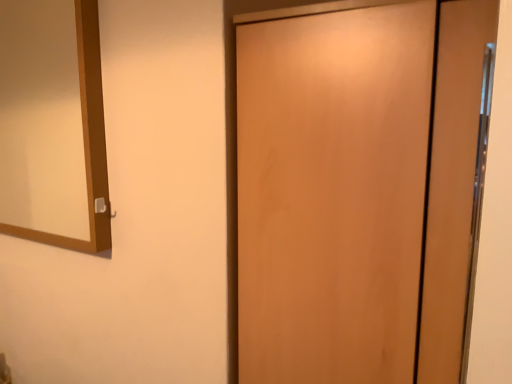
Measure the distance between point (74, 113) and camera.

A distance of 6.58 feet exists between point (74, 113) and camera.

What do you see at coordinates (53, 125) in the screenshot?
I see `matte wooden mirror at left` at bounding box center [53, 125].

Where is `matte wooden mirror at left`? matte wooden mirror at left is located at coordinates (53, 125).

I want to click on matte wooden mirror at left, so click(x=53, y=125).